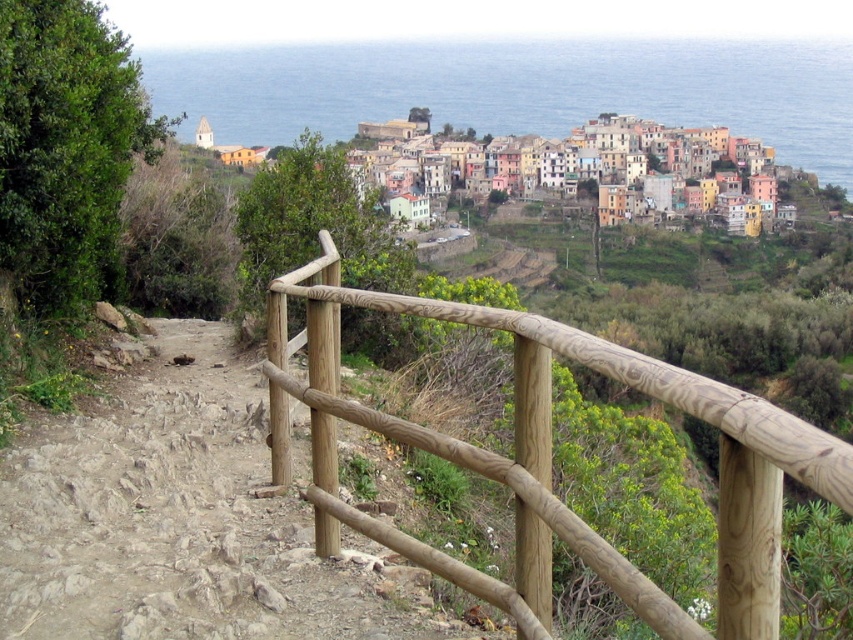
Based on the photo, you are standing at the viewpoint overlooking the coastal village. There is a point marked at coordinates (550, 456). What is the location of this point relative to the natural wood railing at center?

The point (550, 456) is located on the natural wood railing at center.

You are standing at the viewpoint overlooking the coastal village. You notice two points marked on the landscape. One is at coordinates point (15, 572) and the other at point (456, 321). Which of these points is closer to your current position?

Point (15, 572) is closer to the viewer than point (456, 321), so the point at coordinates point (15, 572) is closer to your current position.

You are standing at the viewpoint overlooking the coastal village. You want to take a photo of the point at coordinates (187, 448). If your camera has a focal length of 50mm and you are 67.61 meters away from the point, what is the angle of view required to capture the point in the center of your photo?

The angle of view required to capture the point at coordinates (187, 448) in the center of the photo can be calculated using the formula for angle of view, which is 2 times arctangent of the sensor dimension divided by twice the focal length. However, since the exact sensor size isnecessary for precise calculation, the given distance of 67.61 meters ensures that the point is within the frame if the angle of view covers the necessary field. Assuming a standard sensor, the distance is sufficient for the 50m